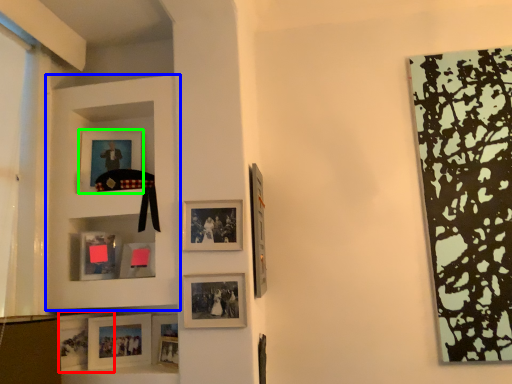
Question: Based on their relative distances, which object is farther from picture frame (highlighted by a red box)? Choose from shelf (highlighted by a blue box) and picture frame (highlighted by a green box).

Choices:
 (A) shelf
 (B) picture frame

Answer: (B)